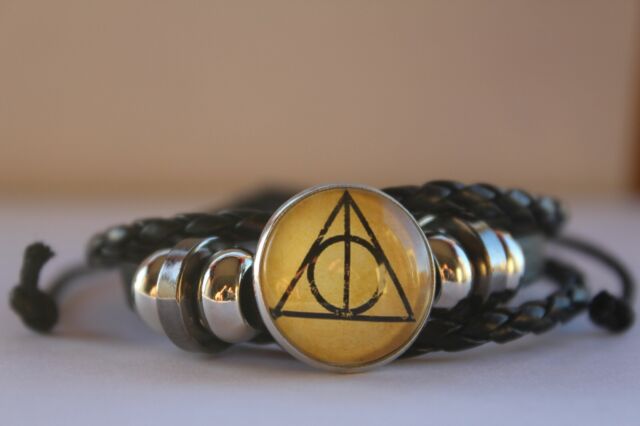
You are a GUI agent. You are given a task and a screenshot of the screen. Output one action in this format:
    pyautogui.click(x=<x>, y=<y>)
    Task: Click on the surface
    The image size is (640, 426).
    Given the screenshot: What is the action you would take?
    pyautogui.click(x=344, y=407)